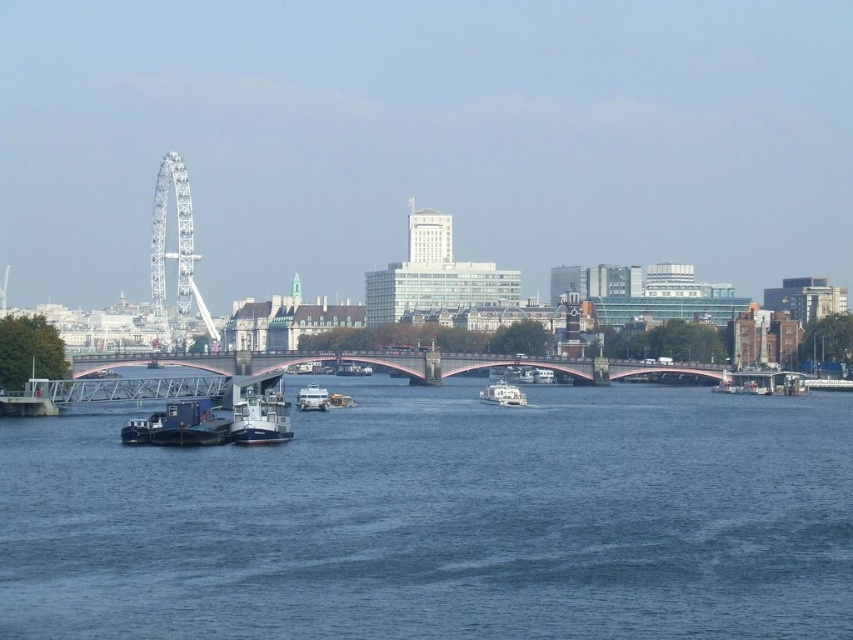
Question: Based on their relative distances, which object is nearer to the metallic bridge at center?

Choices:
 (A) metallic gray barge at right
 (B) white matte boat at center
 (C) metallic blue boat at center

Answer: (A)

Question: Can you confirm if blue water at center is wider than metallic gray barge at right?

Choices:
 (A) yes
 (B) no

Answer: (A)

Question: Which object is closer to the camera taking this photo?

Choices:
 (A) metallic gray barge at right
 (B) white glossy boat at center

Answer: (B)

Question: Can you confirm if metallic blue barge at lower left is positioned above white matte boat at center?

Choices:
 (A) yes
 (B) no

Answer: (A)

Question: Considering the relative positions of metallic blue boat at center and white matte boat at center in the image provided, where is metallic blue boat at center located with respect to white matte boat at center?

Choices:
 (A) below
 (B) above

Answer: (B)

Question: Which point is closer to the camera?

Choices:
 (A) pyautogui.click(x=521, y=397)
 (B) pyautogui.click(x=161, y=358)

Answer: (A)